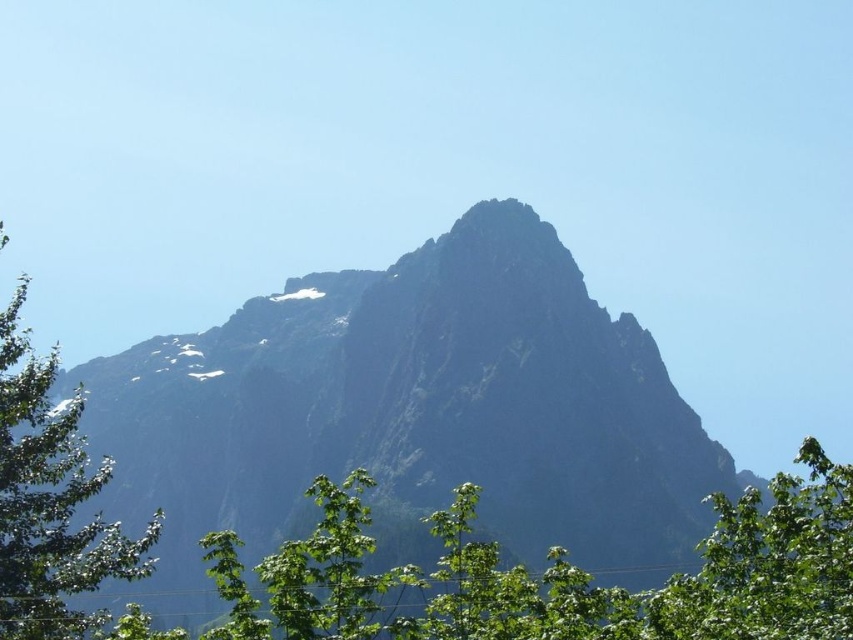
In the scene shown: Who is more distant from viewer, (x=26, y=394) or (x=775, y=616)?

Positioned behind is point (x=26, y=394).

Does green leafy tree at left come in front of green leafy tree at lower right?

No, it is not.

Find the location of a particular element. This screenshot has width=853, height=640. green leafy tree at left is located at coordinates (50, 500).

Identify the location of green leafy tree at left. The height and width of the screenshot is (640, 853). pyautogui.click(x=50, y=500).

Is rugged stone mountain at center below green leafy tree at left?

Indeed, rugged stone mountain at center is positioned under green leafy tree at left.

Which is behind, point (563, 376) or point (119, 547)?

The point (563, 376) is more distant.

Find the location of a particular element. rugged stone mountain at center is located at coordinates (410, 417).

From the picture: Is rugged stone mountain at center positioned before green leafy tree at lower right?

No, it is behind green leafy tree at lower right.

Is rugged stone mountain at center above green leafy tree at lower right?

Actually, rugged stone mountain at center is below green leafy tree at lower right.

Where is `rugged stone mountain at center`? This screenshot has width=853, height=640. rugged stone mountain at center is located at coordinates (410, 417).